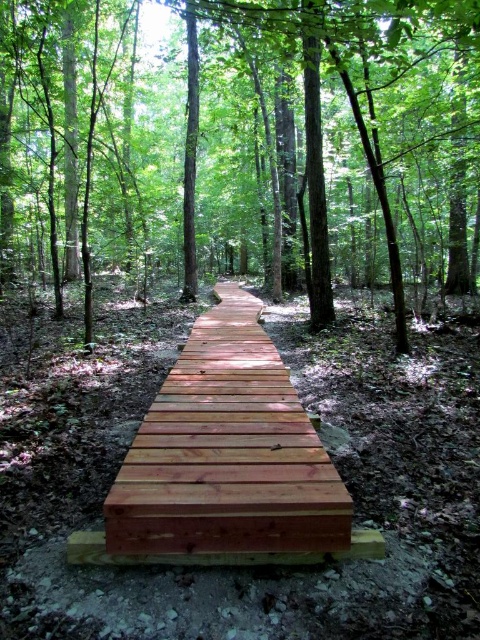
Question: Which of the following is the closest to the observer?

Choices:
 (A) brown wooden bridge at center
 (B) light brown wooden walkway at center

Answer: (B)

Question: Can you confirm if brown wooden bridge at center is bigger than light brown wooden walkway at center?

Choices:
 (A) yes
 (B) no

Answer: (B)

Question: Observing the image, what is the correct spatial positioning of brown wooden bridge at center in reference to light brown wooden walkway at center?

Choices:
 (A) below
 (B) above

Answer: (B)

Question: In this image, where is brown wooden bridge at center located relative to light brown wooden walkway at center?

Choices:
 (A) right
 (B) left

Answer: (A)